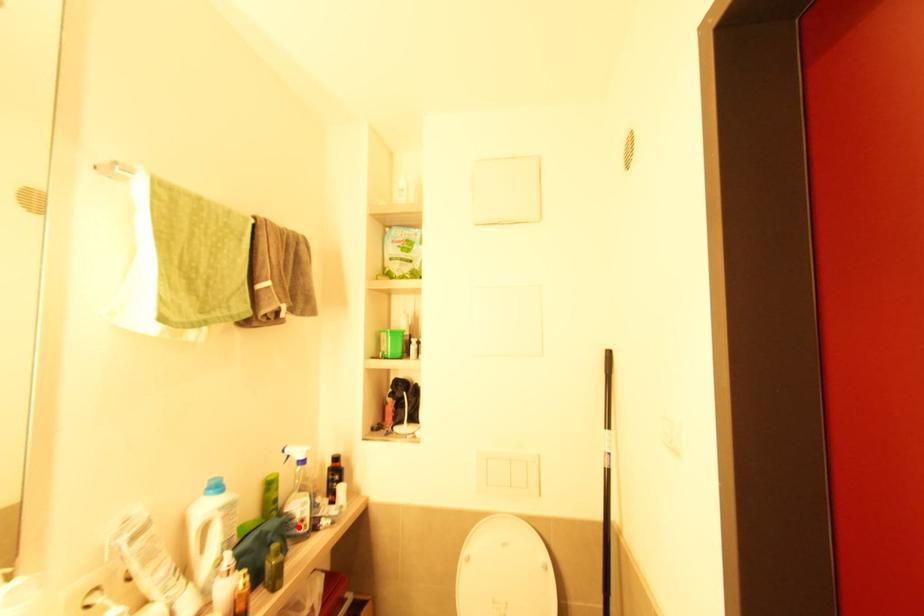
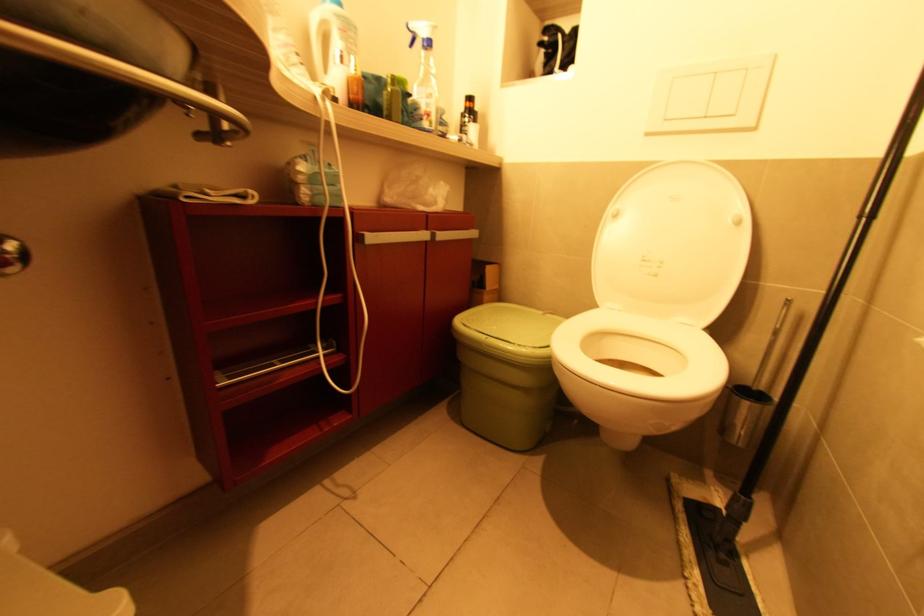
Locate, in the second image, the point that corresponds to the highlighted location in the first image.

(424, 121)